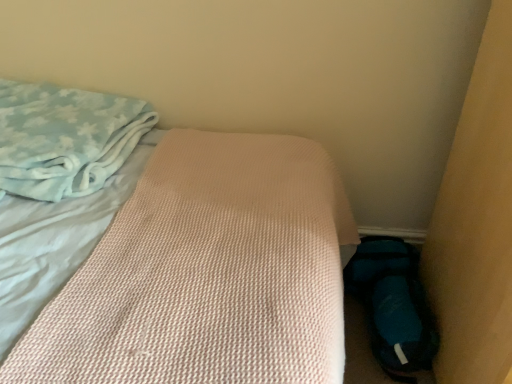
Question: In terms of size, does pink textured mattress at center appear bigger or smaller than blue fabric shoe at lower right?

Choices:
 (A) big
 (B) small

Answer: (A)

Question: Is point (105, 155) closer or farther from the camera than point (374, 274)?

Choices:
 (A) farther
 (B) closer

Answer: (B)

Question: Considering the real-world distances, which object is farthest from the light blue plush blanket at upper left?

Choices:
 (A) pink textured mattress at center
 (B) blue fabric shoe at lower right

Answer: (B)

Question: Which is nearer to the pink textured mattress at center?

Choices:
 (A) light blue plush blanket at upper left
 (B) blue fabric shoe at lower right

Answer: (A)